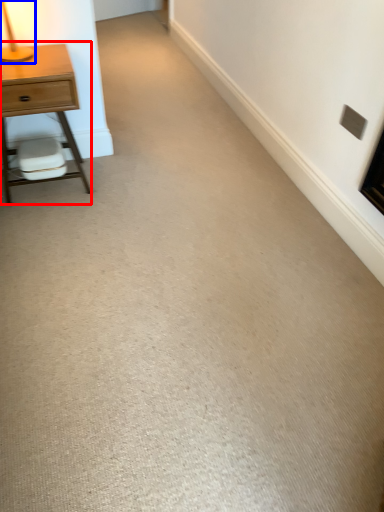
Question: Which point is further to the camera, nightstand (highlighted by a red box) or table lamp (highlighted by a blue box)?

Choices:
 (A) nightstand
 (B) table lamp

Answer: (A)